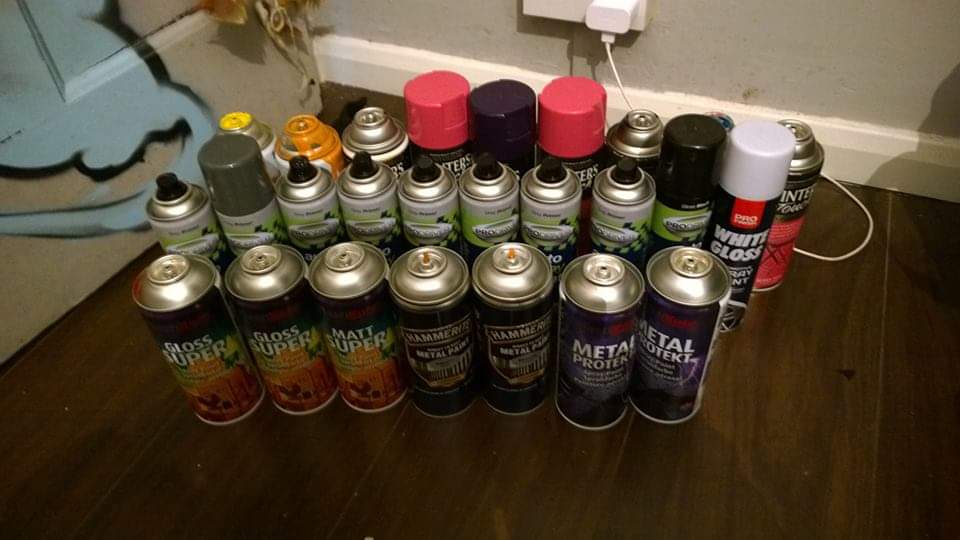
Locate an element on the screen. outlet is located at coordinates (578, 10).